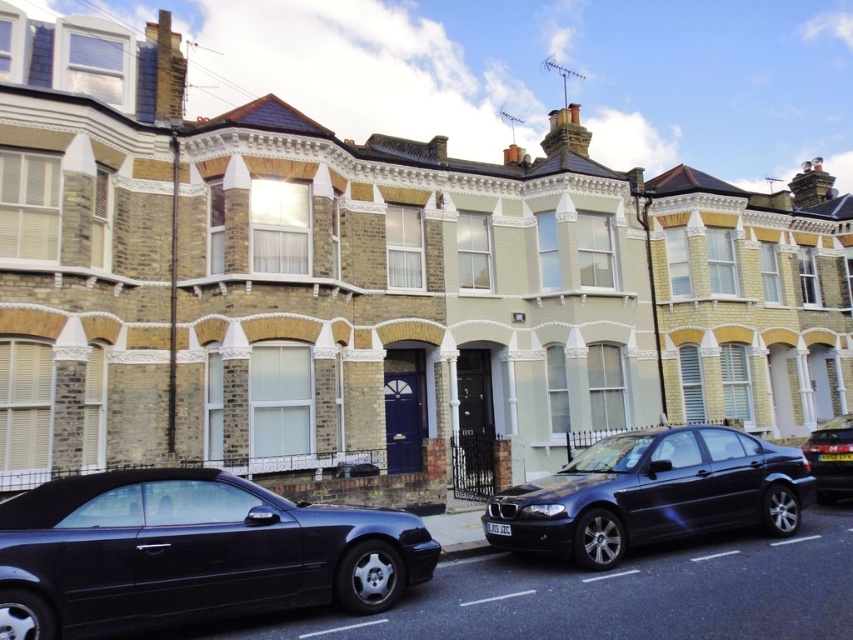
Is glossy black sedan at center positioned in front of shiny black sedan at center?

Yes, glossy black sedan at center is in front of shiny black sedan at center.

Is point (604, 444) closer to viewer compared to point (851, 428)?

Yes, it is in front of point (851, 428).

In order to click on glossy black sedan at center in this screenshot , I will do `click(653, 493)`.

Is shiny black convertible at lower left closer to camera compared to shiny black sedan at center?

Yes.

Which of these two, shiny black convertible at lower left or shiny black sedan at center, stands shorter?

With less height is shiny black sedan at center.

Who is more forward, (90, 515) or (838, 444)?

Positioned in front is point (90, 515).

Where is `shiny black convertible at lower left`? The height and width of the screenshot is (640, 853). shiny black convertible at lower left is located at coordinates (190, 552).

In the scene shown: Is shiny black convertible at lower left positioned in front of glossy black sedan at center?

Yes, shiny black convertible at lower left is in front of glossy black sedan at center.

Between shiny black convertible at lower left and glossy black sedan at center, which one appears on the right side from the viewer's perspective?

From the viewer's perspective, glossy black sedan at center appears more on the right side.

Consider the image. Who is more forward, (390, 522) or (558, 484)?

Point (390, 522)

This screenshot has width=853, height=640. I want to click on shiny black convertible at lower left, so click(190, 552).